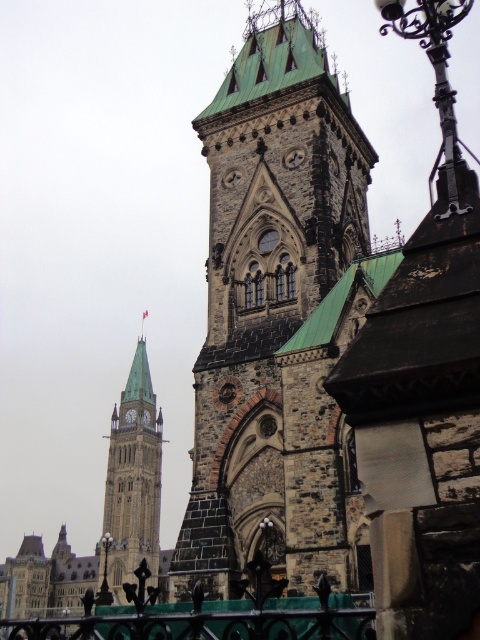
You are a maintenance worker needing to reach the green copper clock tower at left from the green wrought iron fence at lower center. The maintenance cart you drive has a maximum range of 300 feet before needing a recharge. Do you think you can reach the tower without needing to recharge?

The green wrought iron fence at lower center and green copper clock tower at left are 335.72 feet apart from each other. Since the distance exceeds the cart maximum range of 300 feet, you will need to recharge before reaching the tower.

You are standing in front of the two Gothic towers. You notice two points marked on the towers. The first point is at coordinates point (282, 100) and the second is at point (139, 493). Which of these points is physically closer to you?

Point (282, 100) is closer to the viewer than point (139, 493).

You are standing in front of a historic building complex. You see a dark gray stone tower at center and a green copper clock tower at left. Which tower is nearer to you?

The dark gray stone tower at center is closer to the viewer than the green copper clock tower at left.